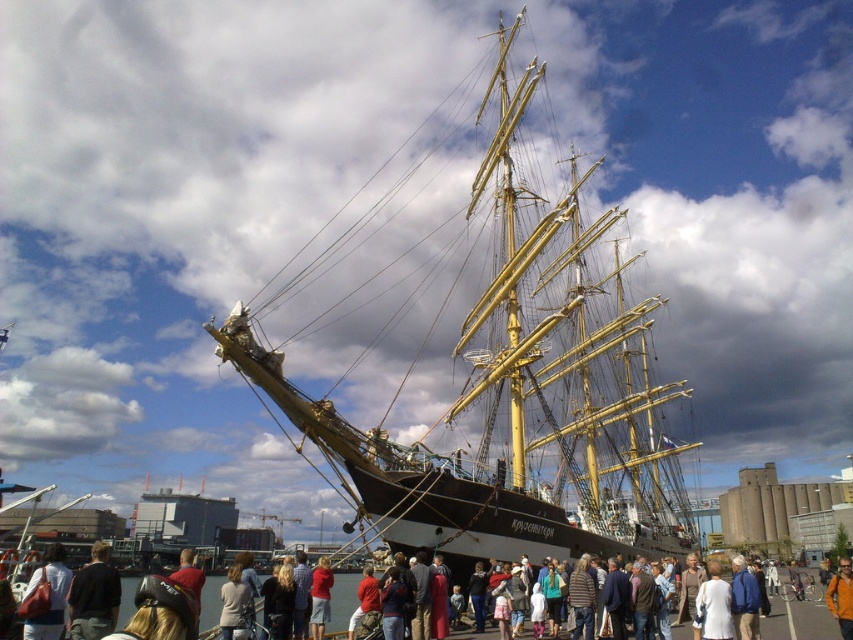
Based on the photo, is dark brown leather jacket at lower left below orange fabric jacket at center?

Yes.

Is dark brown leather jacket at lower left shorter than orange fabric jacket at center?

No, dark brown leather jacket at lower left is not shorter than orange fabric jacket at center.

Where is `dark brown leather jacket at lower left`? The height and width of the screenshot is (640, 853). dark brown leather jacket at lower left is located at coordinates (94, 596).

Does matte white shirt at lower left come in front of orange fabric jacket at center?

Yes, it is.

Which is more to the right, matte white shirt at lower left or orange fabric jacket at center?

orange fabric jacket at center is more to the right.

Which is behind, point (50, 573) or point (840, 579)?

Point (840, 579)

The height and width of the screenshot is (640, 853). Find the location of `matte white shirt at lower left`. matte white shirt at lower left is located at coordinates (48, 596).

This screenshot has width=853, height=640. What do you see at coordinates (515, 388) in the screenshot?
I see `wooden ship at center` at bounding box center [515, 388].

Does wooden ship at center have a greater height compared to orange fabric jacket at center?

Correct, wooden ship at center is much taller as orange fabric jacket at center.

Who is more distant from viewer, (566, 227) or (844, 595)?

The point (566, 227) is behind.

In order to click on wooden ship at center in this screenshot , I will do `click(515, 388)`.